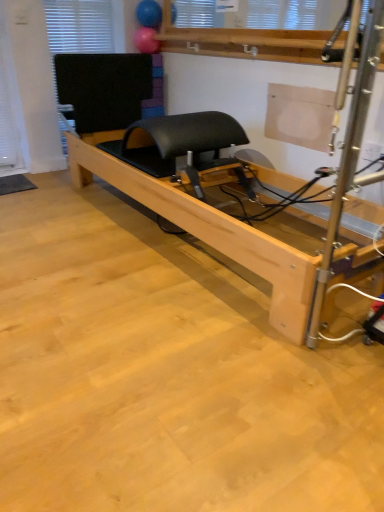
The height and width of the screenshot is (512, 384). Identify the location of empty space that is ontop of black rubber yoga mat at lower left. (12, 178).